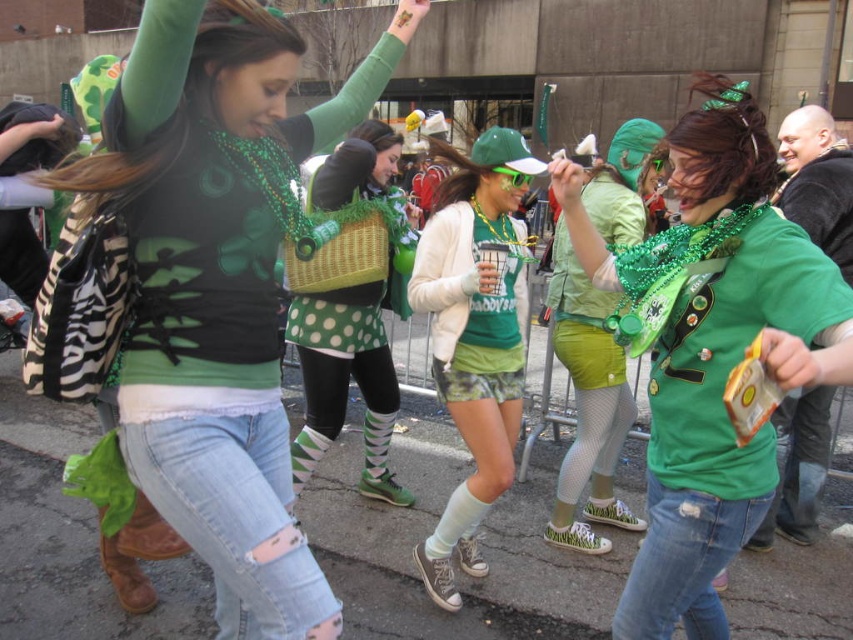
You are a photographer trying to capture a candid shot of the two women in the center wearing matte green shorts at center and green matte shorts at center. Since you want to ensure both are in focus, you need to know which pair of shorts is bigger. Can you tell me which one is larger?

The matte green shorts at center is larger in size than green matte shorts at center, so the matte green shorts at center is the bigger one.

You are standing in the middle of the street during the parade. There are two points marked on the ground in front of you. The first point is at coordinates point (701, 161) and the second point is at point (602, 196). Which point is closer to you?

Point (701, 161) is closer to the viewer than point (602, 196).